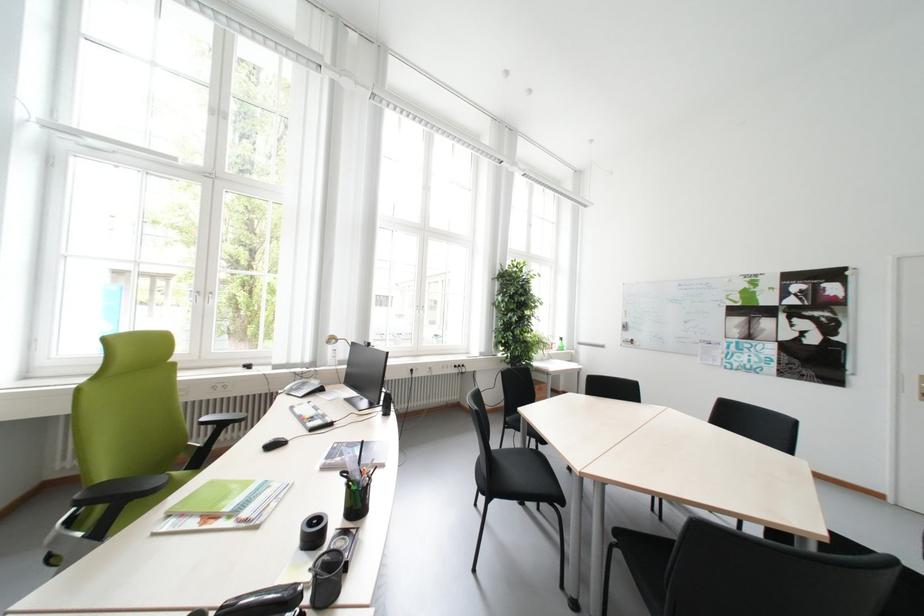
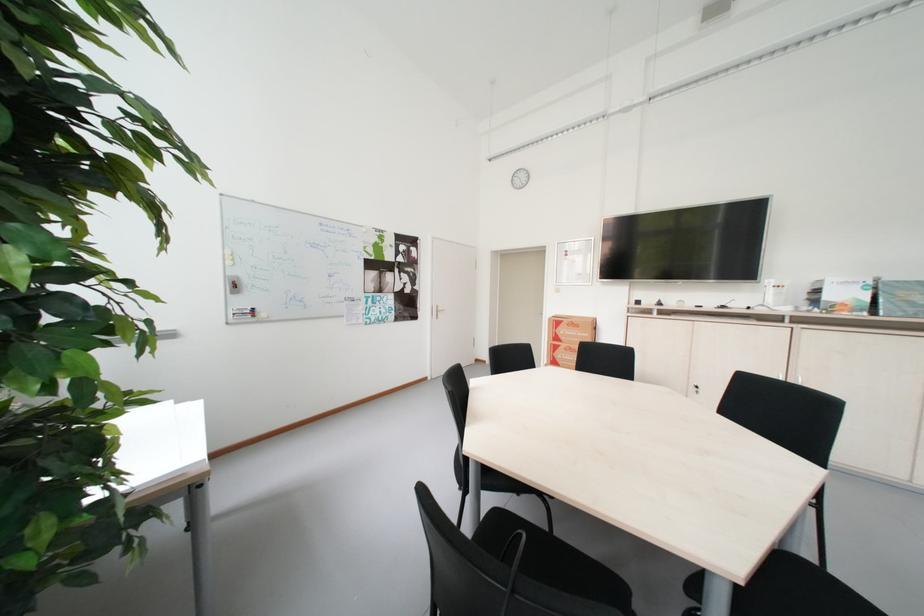
The point at (880, 368) is marked in the first image. Where is the corresponding point in the second image?

(434, 305)